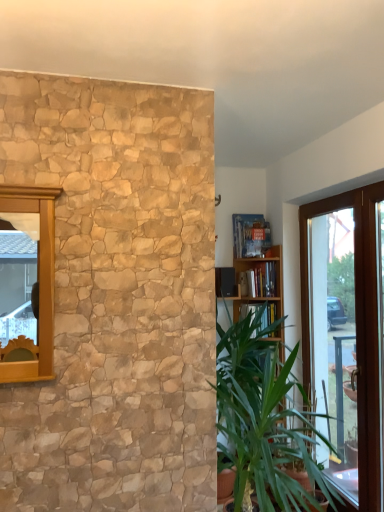
This screenshot has width=384, height=512. I want to click on hardcover book at upper center, placed as the second book when sorted from bottom to top, so click(x=250, y=234).

This screenshot has width=384, height=512. I want to click on hardcover book at center, the first book from the bottom, so click(x=259, y=281).

This screenshot has width=384, height=512. Identify the location of hardcover book at upper center, placed as the second book when sorted from bottom to top. (250, 234).

The width and height of the screenshot is (384, 512). What are the coordinates of `book that appears in front of the hardcover book at center, the first book from the bottom` in the screenshot? It's located at (250, 234).

Is hardcover book at upper center, the 1th book when ordered from top to bottom, taller than hardcover book at center, the first book from the bottom?

Yes.

Would you say hardcover book at upper center, the 1th book when ordered from top to bottom, is inside or outside hardcover book at center, the 2th book from the top?

hardcover book at upper center, the 1th book when ordered from top to bottom, is located beyond the bounds of hardcover book at center, the 2th book from the top.

This screenshot has height=512, width=384. Find the location of `houseplant below the hardcover book at center, the first book from the bottom (from the image's perspective)`. houseplant below the hardcover book at center, the first book from the bottom (from the image's perspective) is located at coordinates (263, 419).

Considering their positions, is hardcover book at center, the 2th book from the top, located in front of or behind green leafy plant at right?

hardcover book at center, the 2th book from the top, is positioned farther from the viewer than green leafy plant at right.

Is green leafy plant at right at the back of hardcover book at center, the 2th book from the top?

hardcover book at center, the 2th book from the top, is not turned away from green leafy plant at right.

Considering the relative sizes of hardcover book at center, the first book from the bottom, and hardcover book at upper center, the 1th book when ordered from top to bottom, in the image provided, is hardcover book at center, the first book from the bottom, bigger than hardcover book at upper center, the 1th book when ordered from top to bottom,?

Actually, hardcover book at center, the first book from the bottom, might be smaller than hardcover book at upper center, the 1th book when ordered from top to bottom.

At what (x,y) coordinates should I click in order to perform the action: click on book above the hardcover book at center, the first book from the bottom (from a real-world perspective). Please return your answer as a coordinate pair (x, y). This screenshot has height=512, width=384. Looking at the image, I should click on (250, 234).

Does point (254, 285) come in front of point (233, 253)?

Yes, point (254, 285) is in front of point (233, 253).

Considering the relative sizes of hardcover book at center, the 2th book from the top, and hardcover book at upper center, the 1th book when ordered from top to bottom, in the image provided, is hardcover book at center, the 2th book from the top, wider than hardcover book at upper center, the 1th book when ordered from top to bottom,?

No.

What's the angular difference between green leafy plant at right and transparent glass door at right's facing directions?

There is a 179-degree angle between the facing directions of green leafy plant at right and transparent glass door at right.

Is green leafy plant at right positioned in front of transparent glass door at right?

Yes, green leafy plant at right is closer to the camera.

Does green leafy plant at right have a larger size compared to transparent glass door at right?

Correct, green leafy plant at right is larger in size than transparent glass door at right.

Is there a large distance between green leafy plant at right and transparent glass door at right?

Actually, green leafy plant at right and transparent glass door at right are a little close together.

Between point (374, 237) and point (255, 224), which one is positioned behind?

The point (255, 224) is farther from the camera.

Can you tell me how much transparent glass door at right and hardcover book at upper center, the 1th book when ordered from top to bottom, differ in facing direction?

They differ by 89.9 degrees in their facing directions.

Can you confirm if transparent glass door at right is thinner than hardcover book at upper center, placed as the second book when sorted from bottom to top?

Correct, the width of transparent glass door at right is less than that of hardcover book at upper center, placed as the second book when sorted from bottom to top.

Is transparent glass door at right shorter than hardcover book at upper center, placed as the second book when sorted from bottom to top?

In fact, transparent glass door at right may be taller than hardcover book at upper center, placed as the second book when sorted from bottom to top.

Which is less distant, (273, 296) or (364, 305)?

The point (364, 305) is closer to the camera.

Consider the image. Can you confirm if hardcover book at center, the 2th book from the top, is taller than transparent glass door at right?

Incorrect, the height of hardcover book at center, the 2th book from the top, is not larger of that of transparent glass door at right.

Is hardcover book at center, the first book from the bottom, at the back of transparent glass door at right?

No, hardcover book at center, the first book from the bottom, is not at the back of transparent glass door at right.

Looking at this image, is transparent glass door at right spatially inside hardcover book at center, the 2th book from the top, or outside of it?

transparent glass door at right is not inside hardcover book at center, the 2th book from the top, it's outside.

Considering the points (366, 281) and (259, 291), which point is in front, point (366, 281) or point (259, 291)?

The point (366, 281) is more forward.

Is transparent glass door at right in front of or behind hardcover book at center, the first book from the bottom, in the image?

Clearly, transparent glass door at right is in front of hardcover book at center, the first book from the bottom.

Locate an element on the screen. Image resolution: width=384 pixels, height=512 pixels. book below the hardcover book at upper center, the 1th book when ordered from top to bottom (from the image's perspective) is located at coordinates (259, 281).

Identify the location of book that is the 1st object above the green leafy plant at right (from a real-world perspective). The width and height of the screenshot is (384, 512). (259, 281).

From the image, which object appears to be farther from hardcover book at center, the first book from the bottom, green leafy plant at right or hardcover book at upper center, the 1th book when ordered from top to bottom?

green leafy plant at right lies further to hardcover book at center, the first book from the bottom, than the other object.

Estimate the real-world distances between objects in this image. Which object is further from hardcover book at center, the first book from the bottom, transparent glass door at right or hardcover book at upper center, the 1th book when ordered from top to bottom?

transparent glass door at right lies further to hardcover book at center, the first book from the bottom, than the other object.

When comparing their distances from hardcover book at center, the 2th book from the top, does green leafy plant at right or transparent glass door at right seem further?

green leafy plant at right is positioned further to the anchor hardcover book at center, the 2th book from the top.

From the image, which object appears to be farther from hardcover book at center, the 2th book from the top, hardcover book at upper center, the 1th book when ordered from top to bottom, or transparent glass door at right?

transparent glass door at right is positioned further to the anchor hardcover book at center, the 2th book from the top.

Considering their positions, is hardcover book at upper center, placed as the second book when sorted from bottom to top, positioned further to green leafy plant at right than hardcover book at center, the 2th book from the top?

hardcover book at upper center, placed as the second book when sorted from bottom to top, lies further to green leafy plant at right than the other object.

From the image, which object appears to be farther from hardcover book at upper center, placed as the second book when sorted from bottom to top, green leafy plant at right or transparent glass door at right?

The object further to hardcover book at upper center, placed as the second book when sorted from bottom to top, is green leafy plant at right.

Based on their spatial positions, is green leafy plant at right or hardcover book at center, the first book from the bottom, further from hardcover book at upper center, the 1th book when ordered from top to bottom?

green leafy plant at right is positioned further to the anchor hardcover book at upper center, the 1th book when ordered from top to bottom.

From the image, which object appears to be farther from green leafy plant at right, hardcover book at upper center, the 1th book when ordered from top to bottom, or transparent glass door at right?

The object further to green leafy plant at right is hardcover book at upper center, the 1th book when ordered from top to bottom.

Locate an element on the screen. The width and height of the screenshot is (384, 512). book between green leafy plant at right and hardcover book at center, the first book from the bottom, along the z-axis is located at coordinates (250, 234).

Identify the location of window positioned between green leafy plant at right and hardcover book at upper center, the 1th book when ordered from top to bottom, from near to far. (357, 325).

Where is `window between green leafy plant at right and hardcover book at center, the 2th book from the top, along the z-axis`? window between green leafy plant at right and hardcover book at center, the 2th book from the top, along the z-axis is located at coordinates (357, 325).

The image size is (384, 512). In order to click on book between transparent glass door at right and hardcover book at center, the 2th book from the top, from front to back in this screenshot , I will do `click(250, 234)`.